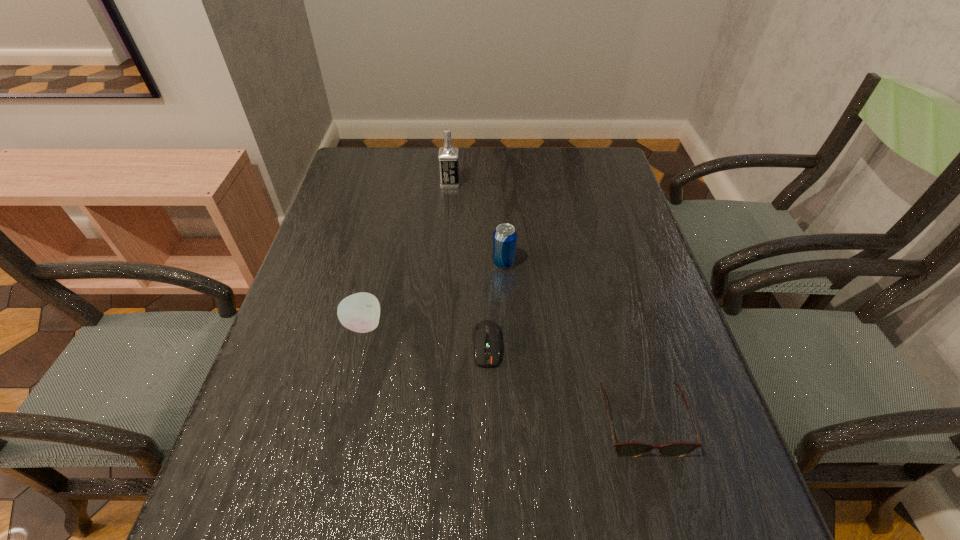
The width and height of the screenshot is (960, 540). What are the coordinates of `vacant space that's between the beer can and the third shortest object` in the screenshot? It's located at pos(434,294).

Where is `vacant space in between the nearest object and the apple`? The width and height of the screenshot is (960, 540). vacant space in between the nearest object and the apple is located at coordinates (502, 374).

The width and height of the screenshot is (960, 540). I want to click on object that stands as the second closest to the second shortest object, so (505, 236).

Choose which object is the third nearest neighbor to the computer equipment. Please provide its 2D coordinates. Your answer should be formatted as a tuple, i.e. [(x, y)], where the tuple contains the x and y coordinates of a point satisfying the conditions above.

[(360, 312)]

Where is `vacant space that satisfies the following two spatial constraints: 1. on the front label of the farthest object; 2. on the back side of the fourth nearest object`? The height and width of the screenshot is (540, 960). vacant space that satisfies the following two spatial constraints: 1. on the front label of the farthest object; 2. on the back side of the fourth nearest object is located at coordinates (444, 262).